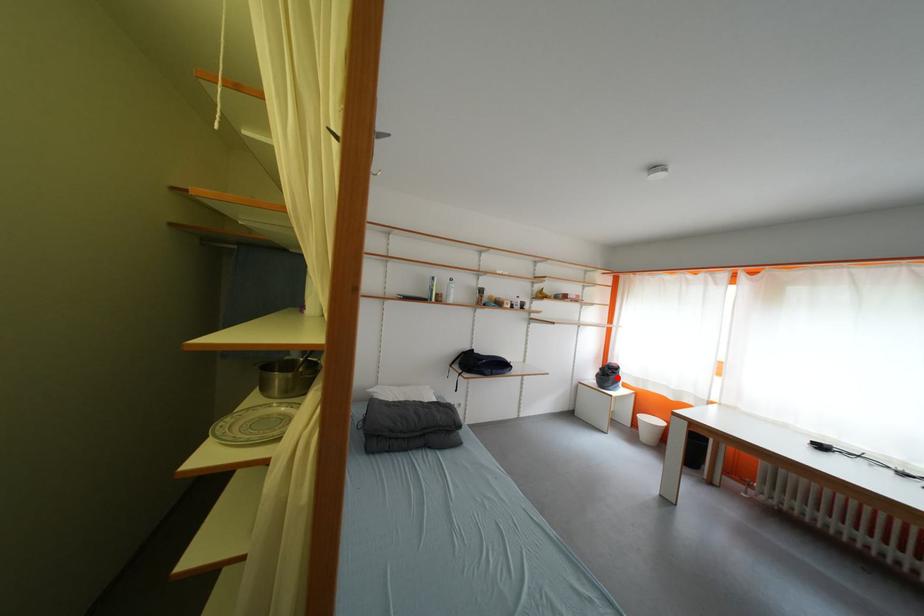
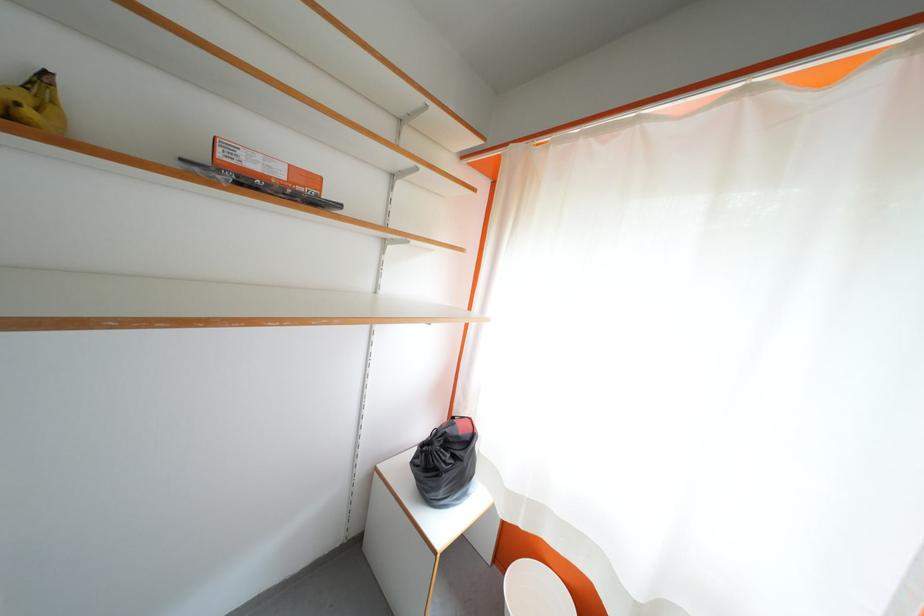
Find the pixel in the second image that matches the highlighted location in the first image.

(455, 460)